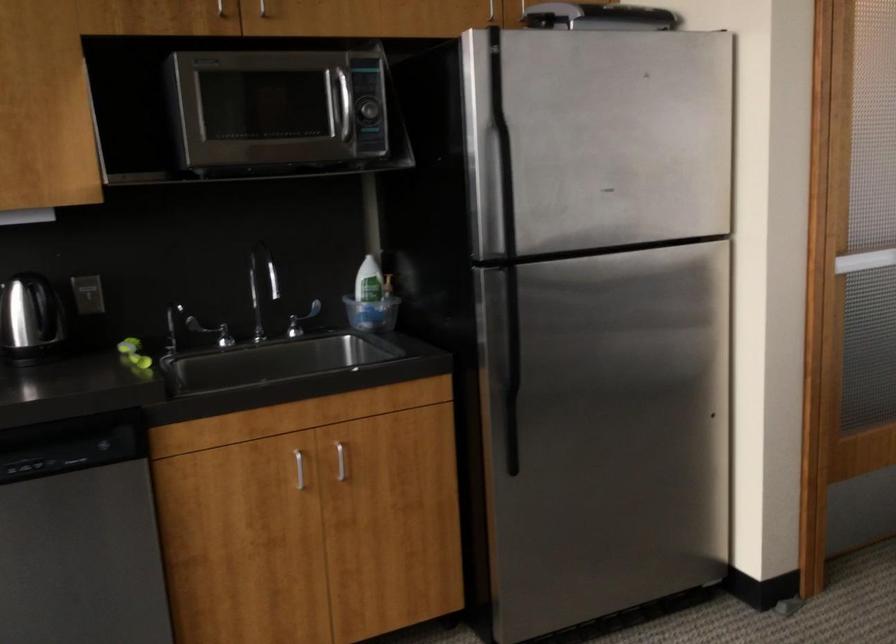
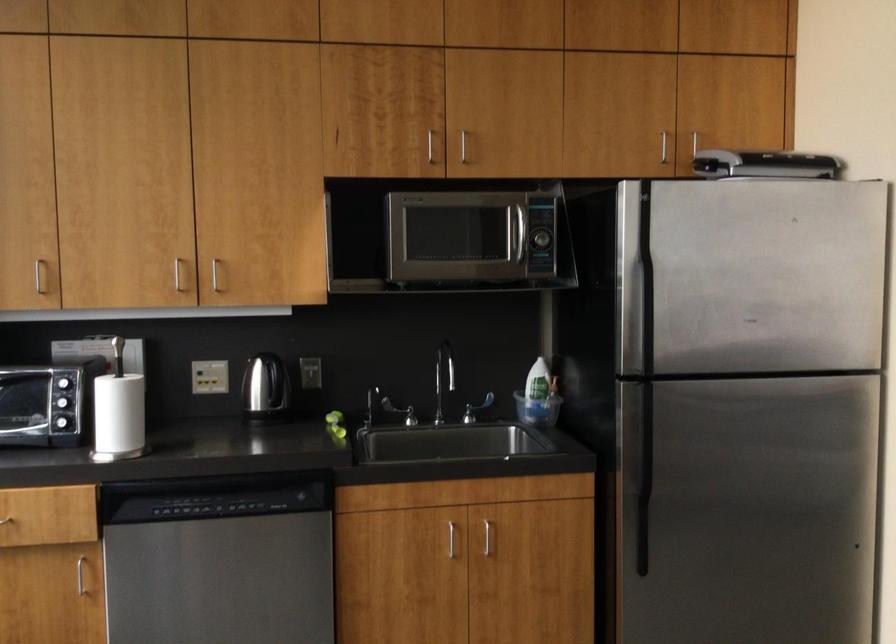
Where in the second image is the point corresponding to pixel 369 111 from the first image?

(540, 239)